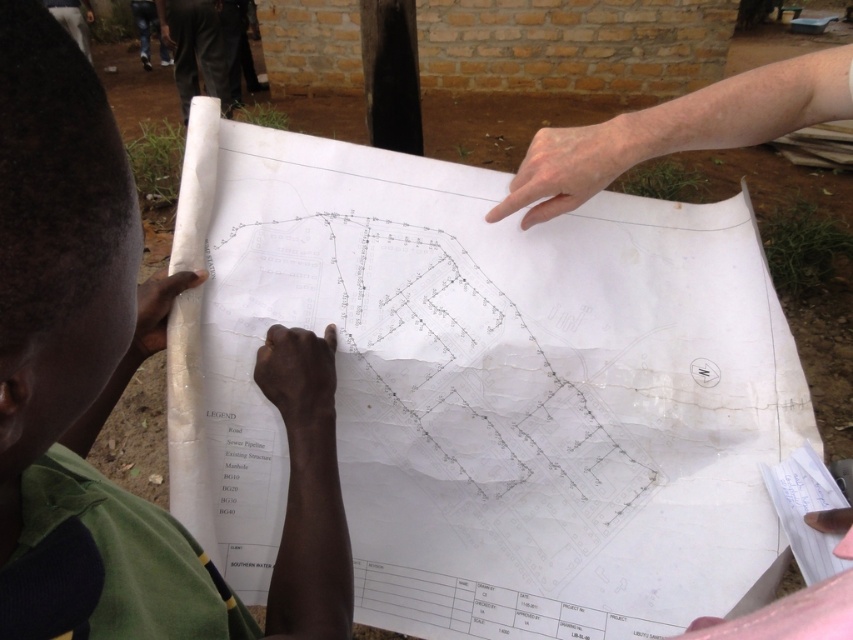
Between green fabric shirt at lower left and black fabric pants at upper left, which one appears on the right side from the viewer's perspective?

green fabric shirt at lower left

Can you confirm if green fabric shirt at lower left is positioned below black fabric pants at upper left?

Indeed, green fabric shirt at lower left is positioned under black fabric pants at upper left.

Is point (9, 394) positioned after point (172, 51)?

That is False.

Where is `green fabric shirt at lower left`? green fabric shirt at lower left is located at coordinates (79, 365).